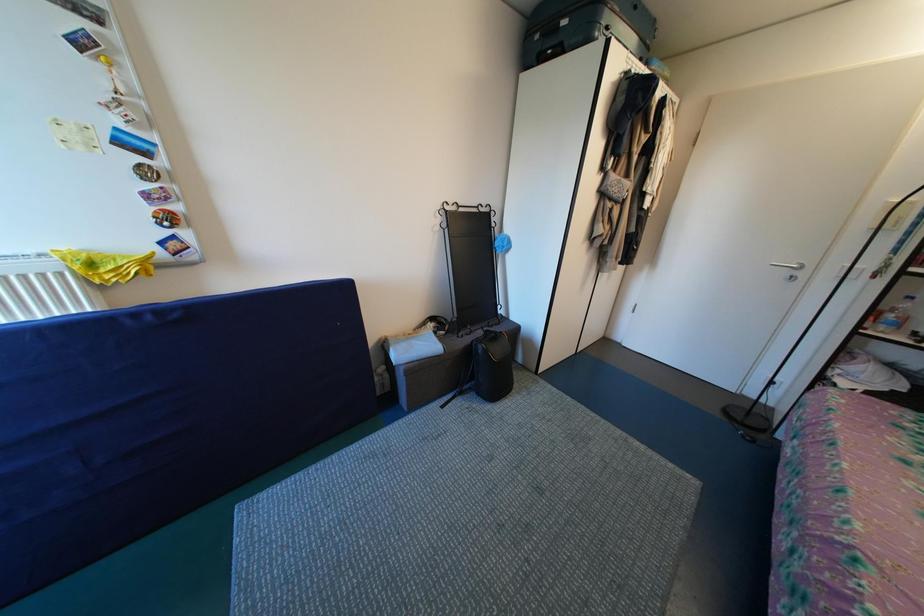
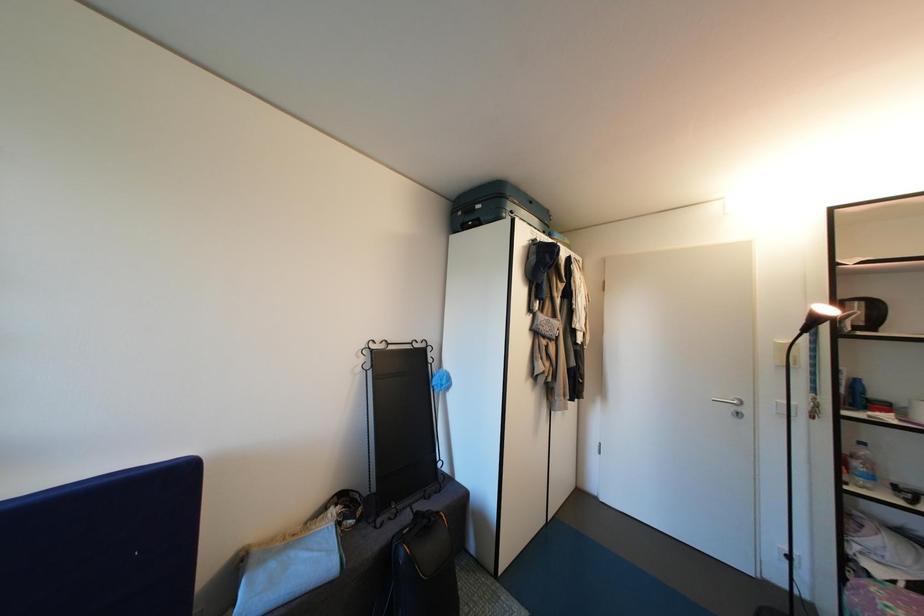
Question: The first image is from the beginning of the video and the second image is from the end. How did the camera likely rotate when shooting the video?

Choices:
 (A) Left
 (B) Right
 (C) Up
 (D) Down

Answer: (C)